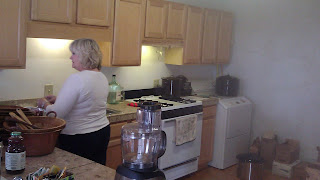
Where is `oven`? This screenshot has width=320, height=180. oven is located at coordinates (170, 137).